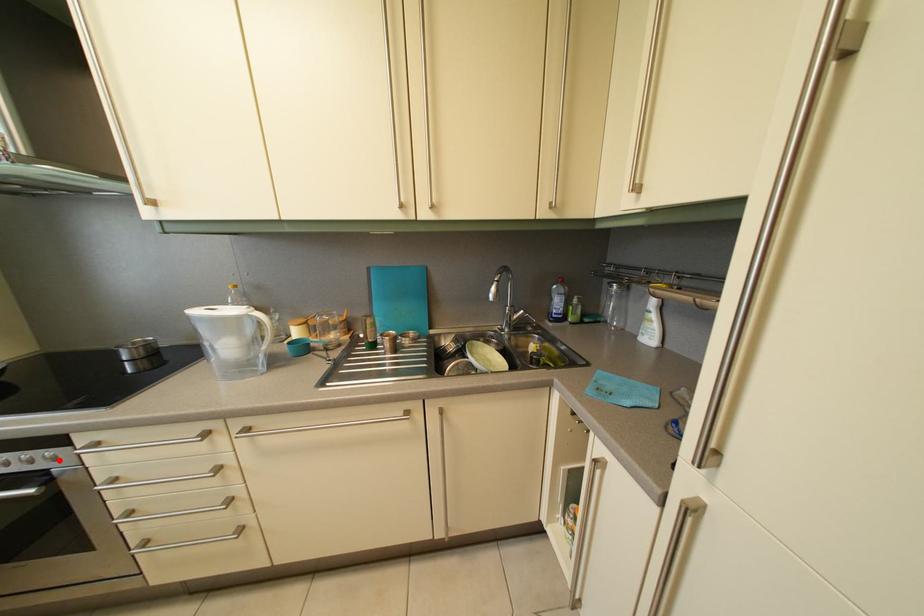
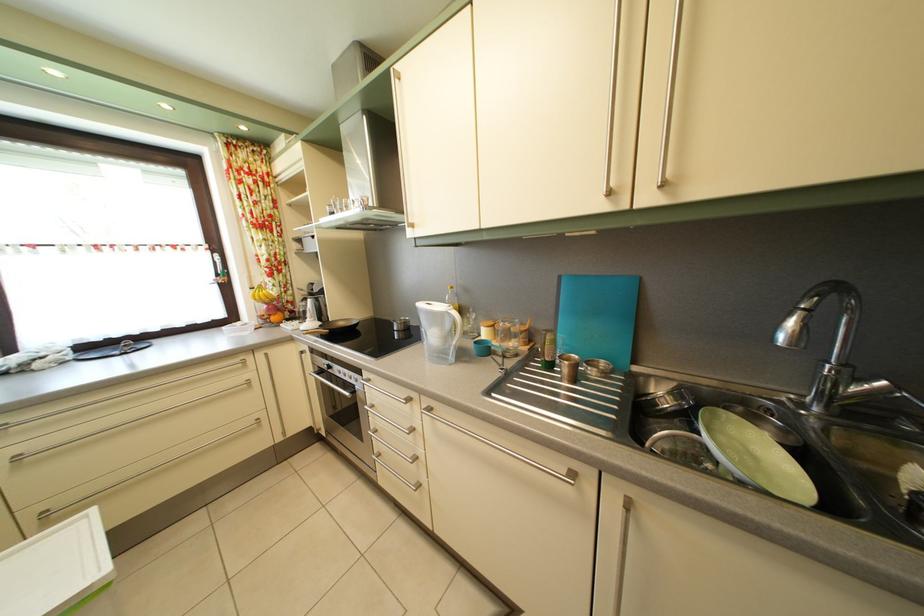
Question: I am providing you with two images of the same scene from different viewpoints. Image1 has a red point marked. In image2, the corresponding 3D location appears at what relative position? Reply with the corresponding letter.

Choices:
 (A) Closer
 (B) Farther

Answer: (B)